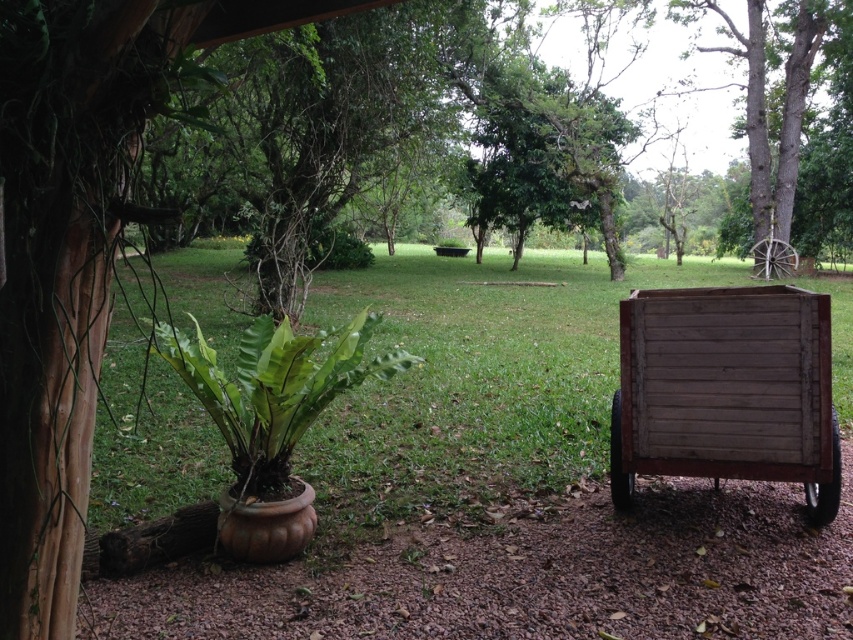
You are a gardener who wants to mow the lawn. You see the green grass at center and the weathered wood wagon at lower right. Which area should you prioritize mowing first based on their height?

The green grass at center should be prioritized for mowing first since it is much taller than the weathered wood wagon at lower right, indicating it needs attention.

You are a gardener who needs to move the weathered wood wagon at lower right to the green grass at center. Can you push it directly without moving any other objects in the scene?

The distance between the green grass at center and the weathered wood wagon at lower right is 3.74 meters. Since there are no other objects mentioned in the scene between them, you can push the wagon directly to the grass.

You are standing in the garden and see two points marked in the image. Which point is closer to you, point (535, 438) or point (618, 436)?

Point (618, 436) is closer to you because point (535, 438) is behind it.